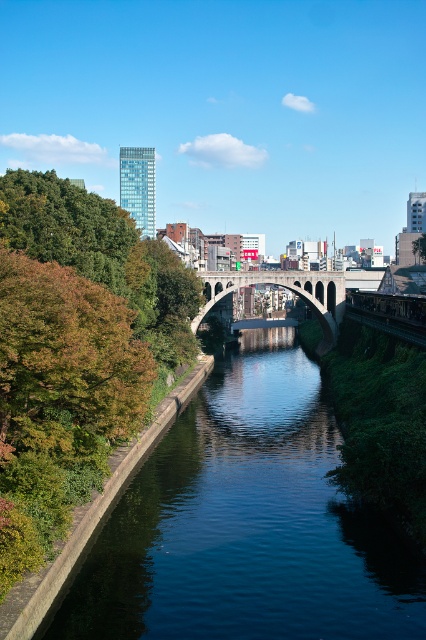
Question: Can you confirm if green concrete river at center is smaller than green leafy trees at left?

Choices:
 (A) yes
 (B) no

Answer: (A)

Question: Is green concrete river at center below green leafy trees at left?

Choices:
 (A) no
 (B) yes

Answer: (B)

Question: Among these objects, which one is farthest from the camera?

Choices:
 (A) green leafy trees at left
 (B) green concrete river at center

Answer: (A)

Question: Which point appears farthest from the camera in this image?

Choices:
 (A) (198, 321)
 (B) (143, 312)
 (C) (284, 476)

Answer: (A)

Question: Which object appears farthest from the camera in this image?

Choices:
 (A) green concrete river at center
 (B) green leafy trees at left

Answer: (B)

Question: Does green leafy trees at left appear on the left side of concrete arch bridge at center?

Choices:
 (A) yes
 (B) no

Answer: (A)